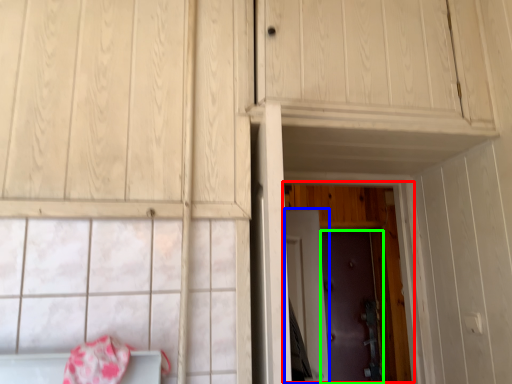
Question: Which object is the farthest from door (highlighted by a red box)? Choose among these: door (highlighted by a blue box) or door (highlighted by a green box).

Choices:
 (A) door
 (B) door

Answer: (A)